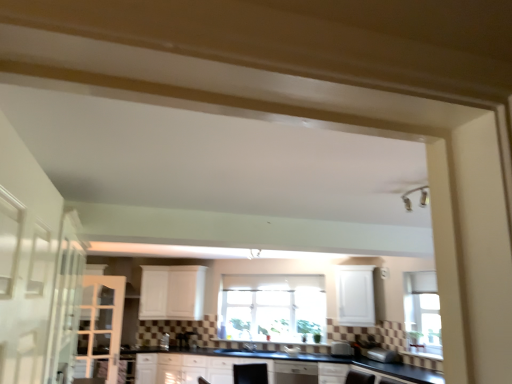
Question: From the image's perspective, is white glass screen door at left located above or below satin silver toaster at lower center, the 1th appliance when ordered from left to right?

Choices:
 (A) below
 (B) above

Answer: (B)

Question: From their relative heights in the image, would you say white glass screen door at left is taller or shorter than satin silver toaster at lower center, the 1th appliance when ordered from left to right?

Choices:
 (A) short
 (B) tall

Answer: (B)

Question: Estimate the real-world distances between objects in this image. Which object is farther from the white glass screen door at left?

Choices:
 (A) clear glass window at center
 (B) white matte cabinet at center, acting as the 2th cabinetry starting from the left
 (C) satin silver toaster at lower center, which is counted as the second appliance, starting from the left
 (D) white matte cabinet at center, the first cabinetry in the back-to-front sequence
 (E) satin silver toaster at lower center, arranged as the second appliance when viewed from the front

Answer: (C)

Question: Estimate the real-world distances between objects in this image. Which object is closer to the white matte cabinet at center, which appears as the 1th cabinetry when viewed from the front?

Choices:
 (A) white matte cabinet at center, the 1th cabinetry in the left-to-right sequence
 (B) white glass screen door at left
 (C) black glossy sink at center
 (D) satin silver toaster at lower center, which ranks as the second appliance in right-to-left order
 (E) satin silver toaster at lower center, the 2th appliance positioned from the back

Answer: (D)